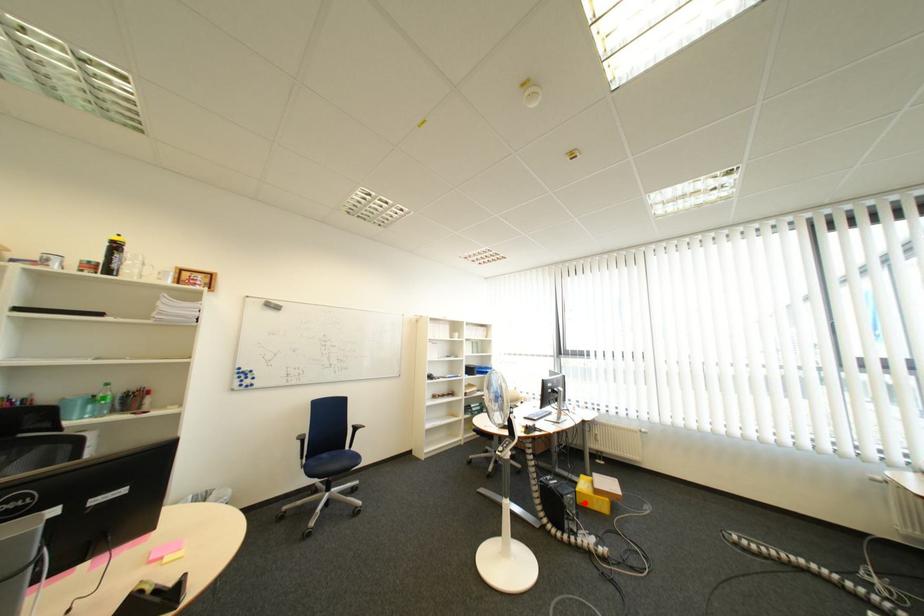
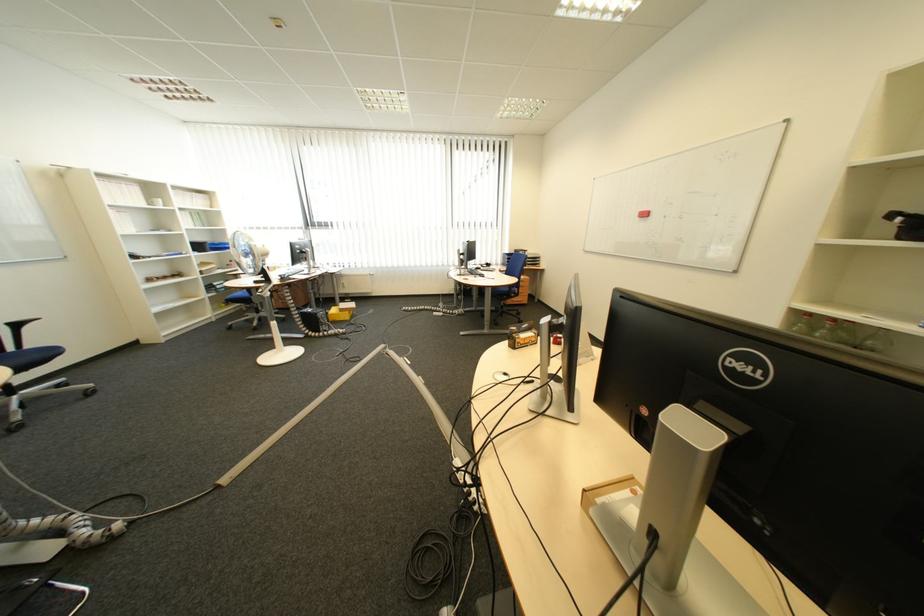
Question: I am providing you with two images of the same scene from different viewpoints. A red point is marked on the first image. Is the red point's position out of view in image 2?

Choices:
 (A) Yes
 (B) No

Answer: (B)